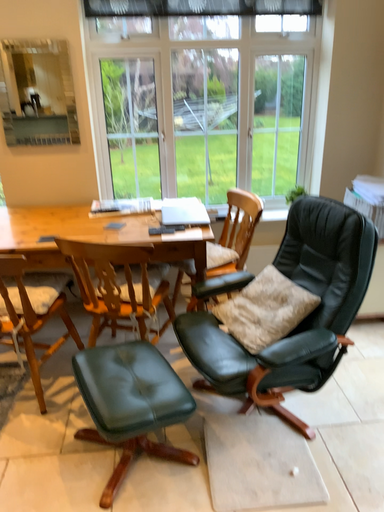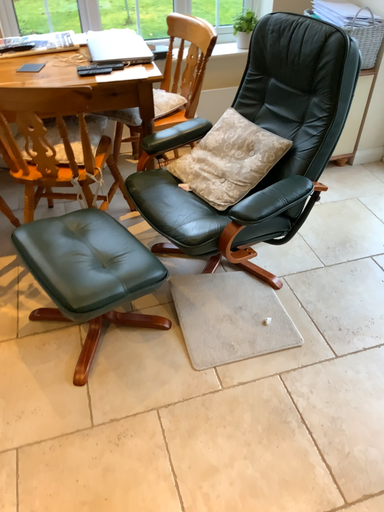
Question: How did the camera likely rotate when shooting the video?

Choices:
 (A) rotated downward
 (B) rotated upward

Answer: (A)